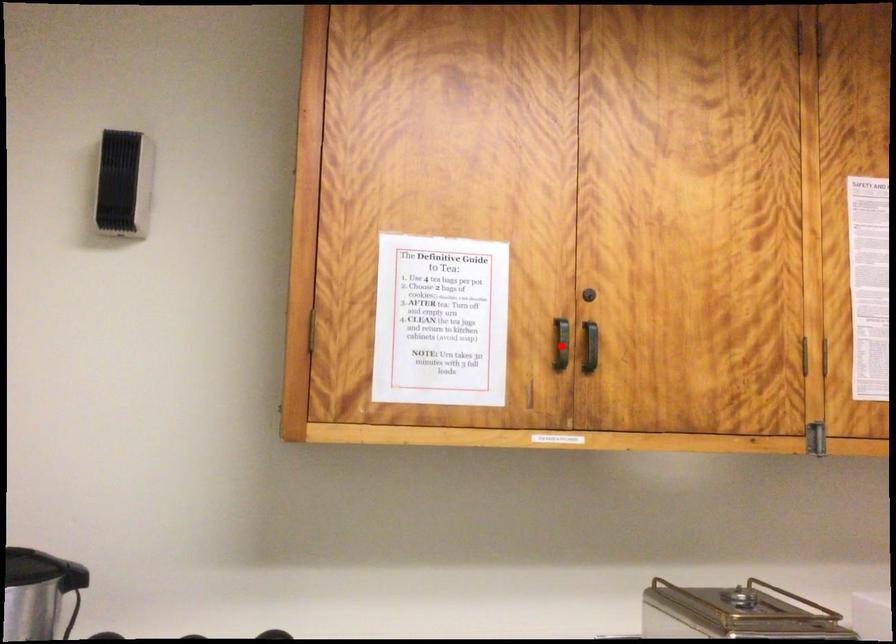
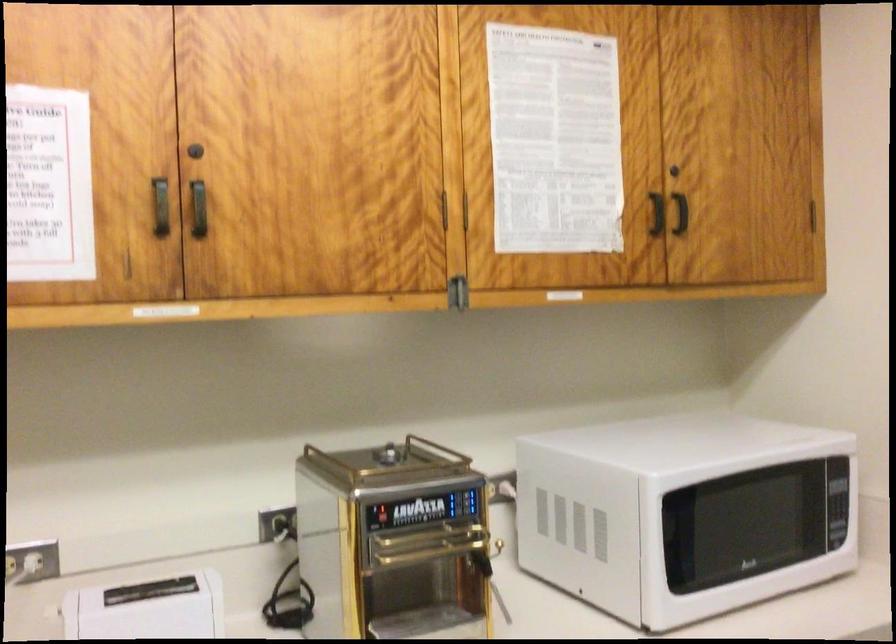
Locate, in the second image, the point that corresponds to the highlighted location in the first image.

(159, 205)